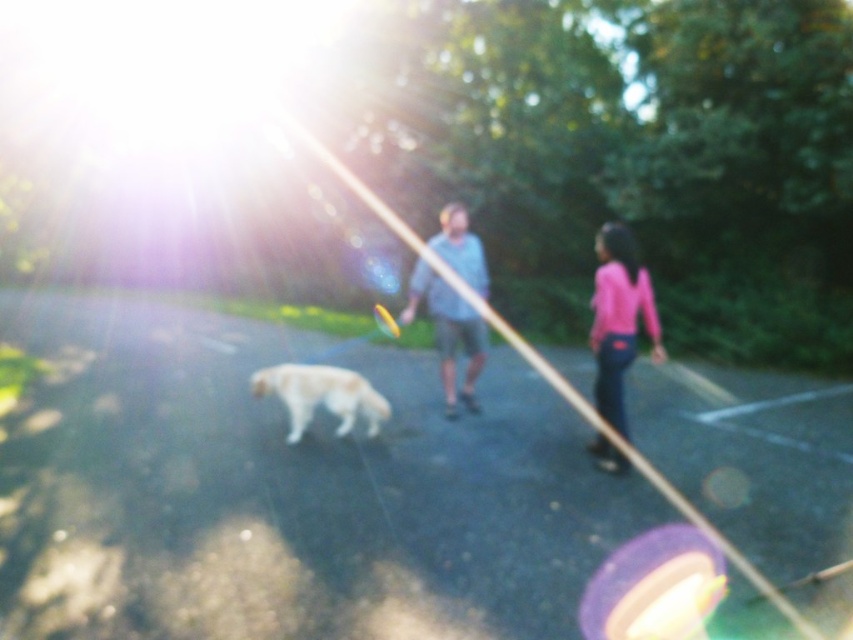
Question: Considering the real-world distances, which object is farthest from the pink matte shirt at right?

Choices:
 (A) light blue fabric shirt at center
 (B) golden fur dog at center

Answer: (B)

Question: Is light blue fabric shirt at center to the right of golden fur dog at center from the viewer's perspective?

Choices:
 (A) no
 (B) yes

Answer: (B)

Question: Which of these objects is positioned closest to the golden fur dog at center?

Choices:
 (A) light blue fabric shirt at center
 (B) pink matte shirt at right

Answer: (A)

Question: Is pink matte shirt at right bigger than golden fur dog at center?

Choices:
 (A) no
 (B) yes

Answer: (B)

Question: Which point is farther to the camera?

Choices:
 (A) (299, 401)
 (B) (614, 424)
 (C) (445, 284)

Answer: (C)

Question: Is pink matte shirt at right closer to the viewer compared to golden fur dog at center?

Choices:
 (A) no
 (B) yes

Answer: (B)